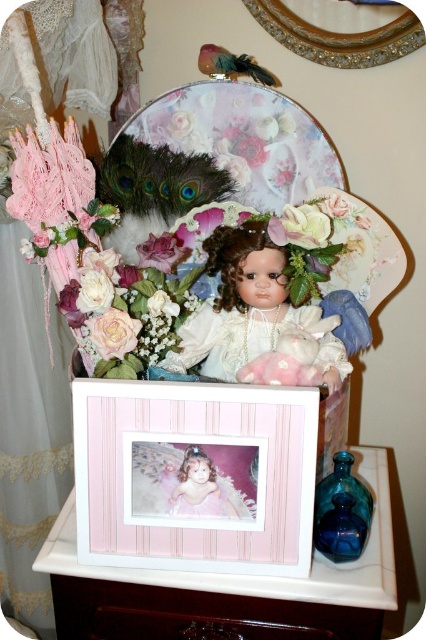
You are arranging a floral display and need to place the pink wood picture frame at center and the pink silk flower at center. According to the scene, which object is located to the left of the other?

The pink silk flower at center is to the left of the pink wood picture frame at center because the pink wood picture frame at center is positioned on the right side of the pink silk flower at center.

You are a florist arranging flowers for a special event. You have a porcelain doll at center and a pink silk flower at center. Which object should you place first if you want to ensure there is enough space for both?

The porcelain doll at center might be wider than the pink silk flower at center, so you should place the porcelain doll at center first to ensure there is enough space for both.